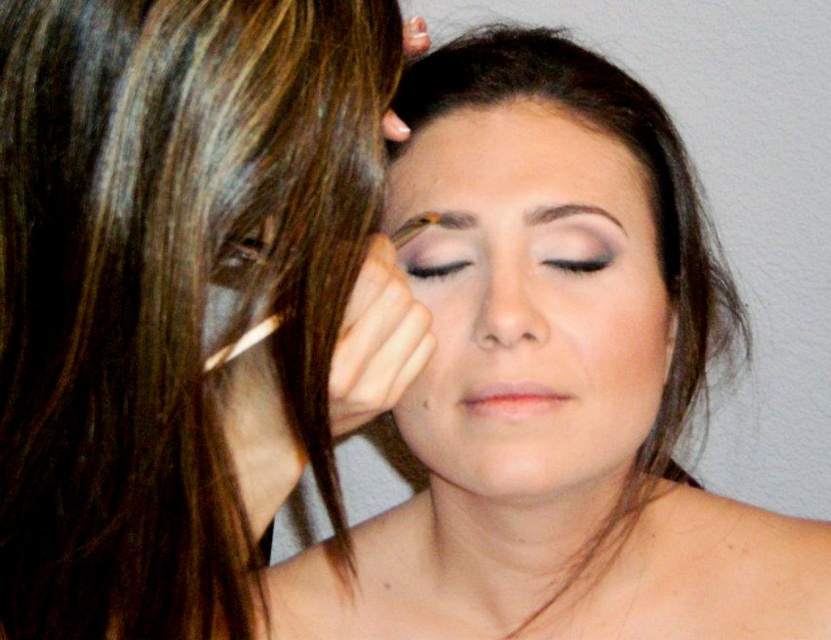
You are a makeup artist preparing for a client. You need to place the matte pink lipstick at lower center and the matte black eyeliner at center into a drawer. The drawer has a divider that separates items into left and right sections. If you want to keep their original positions relative to each other, which side should you place each item?

Since the matte pink lipstick at lower center is to the right of the matte black eyeliner at center in the original scene, you should place the matte black eyeliner at center on the left side of the drawer and the matte pink lipstick at lower center on the right side to maintain their relative positions.

You are a makeup artist holding a camera 15 inches away from your face. You want to apply the matte purple eyeshadow at center to your client. Is the eyeshadow within your camera view?

The matte purple eyeshadow at center is 15.65 inches away from the camera, which is slightly further than your 15 inches distance. Therefore, the eyeshadow may be just out of your camera view.